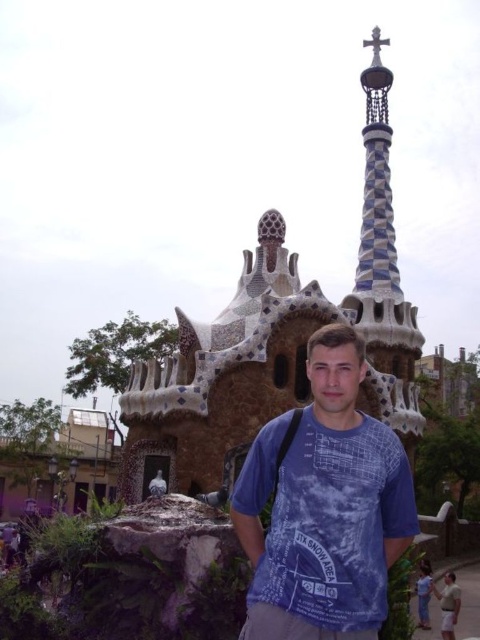
Question: Which point is farther from the camera taking this photo?

Choices:
 (A) (347, 602)
 (B) (403, 296)

Answer: (B)

Question: Which object is farther from the camera taking this photo?

Choices:
 (A) multicolored mosaic spire at upper right
 (B) blue tie-dye t-shirt at center

Answer: (A)

Question: Is the position of blue tie-dye t-shirt at center more distant than that of multicolored mosaic spire at upper right?

Choices:
 (A) yes
 (B) no

Answer: (B)

Question: In this image, where is multicolored mosaic spire at upper right located relative to smooth beige sand at lower right?

Choices:
 (A) above
 (B) below

Answer: (A)

Question: Which of the following is the closest to the observer?

Choices:
 (A) (446, 584)
 (B) (275, 445)

Answer: (B)

Question: Is blue tie-dye t-shirt at center to the right of smooth beige sand at lower right from the viewer's perspective?

Choices:
 (A) yes
 (B) no

Answer: (B)